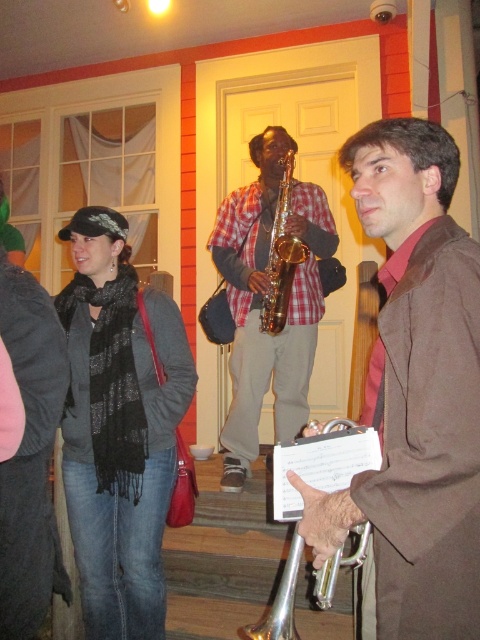
Which is below, brown leather jacket at center or gold shiny trumpet at center?

brown leather jacket at center

Between point (433, 451) and point (287, 252), which one is positioned behind?

Positioned behind is point (287, 252).

Image resolution: width=480 pixels, height=640 pixels. Identify the location of brown leather jacket at center. (415, 394).

Can you confirm if silver/metallic trumpet at center is smaller than gold shiny trumpet at center?

Yes, silver/metallic trumpet at center is smaller than gold shiny trumpet at center.

Which is behind, point (261, 620) or point (283, 260)?

The point (283, 260) is behind.

Between point (287, 637) and point (298, 243), which one is positioned behind?

The point (298, 243) is more distant.

This screenshot has width=480, height=640. Find the location of `silver/metallic trumpet at center`. silver/metallic trumpet at center is located at coordinates (323, 461).

Can you confirm if brown leather jacket at center is positioned to the right of black scarf at left?

Indeed, brown leather jacket at center is positioned on the right side of black scarf at left.

Who is positioned more to the left, brown leather jacket at center or black scarf at left?

Positioned to the left is black scarf at left.

Looking at this image, who is more distant from viewer, (478, 440) or (148, 600)?

The point (148, 600) is behind.

Image resolution: width=480 pixels, height=640 pixels. Find the location of `brown leather jacket at center`. brown leather jacket at center is located at coordinates (415, 394).